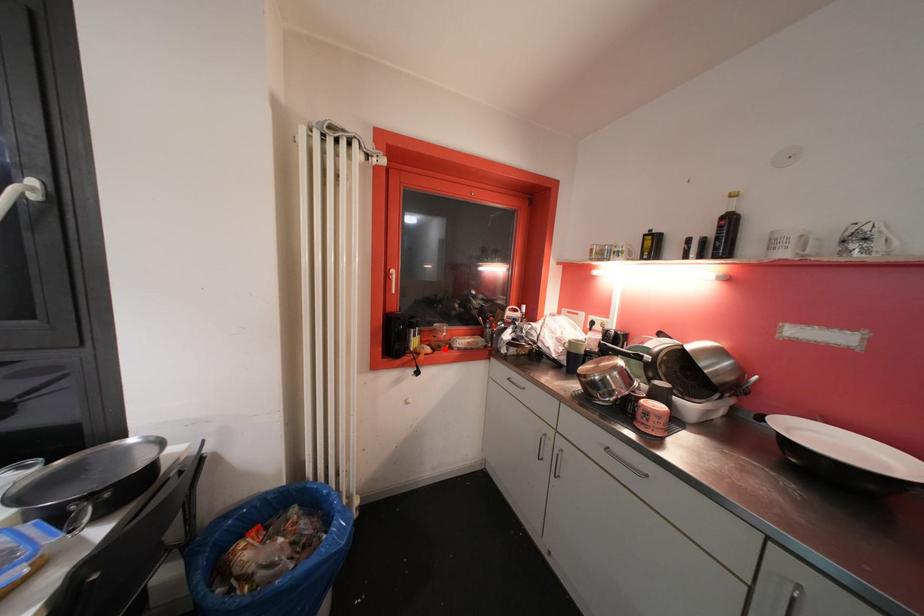
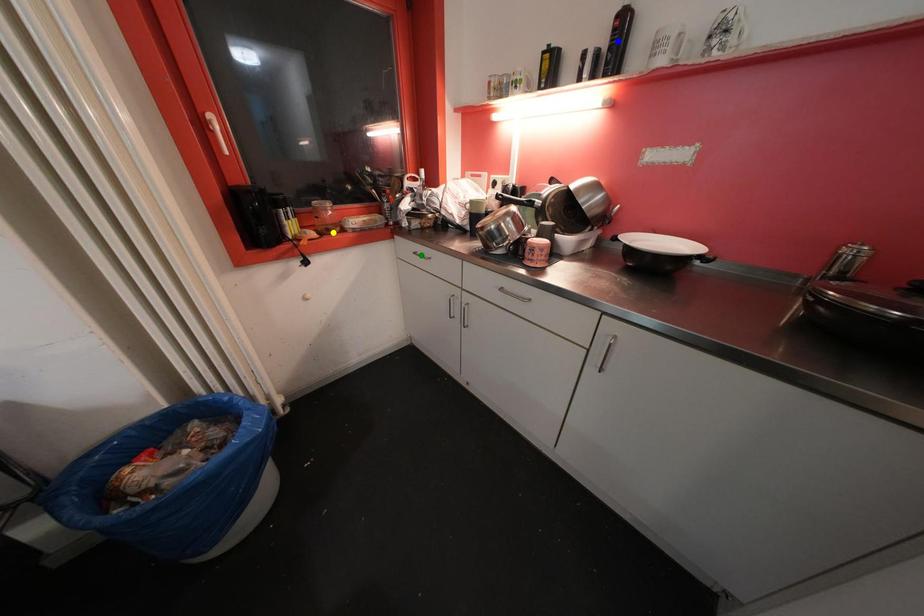
Question: I am providing you with two images of the same scene from different viewpoints. A red point is marked on the first image. You are given multiple points on the second image. In image 2, which mark is for the same physical point as the one in image 1?

Choices:
 (A) green point
 (B) yellow point
 (C) blue point

Answer: (B)